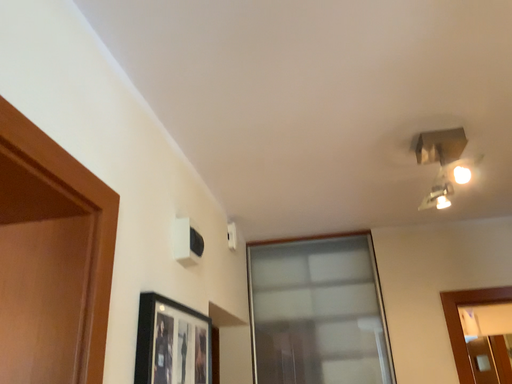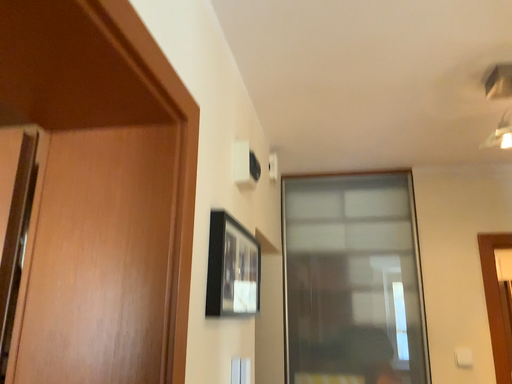
Question: How did the camera likely rotate when shooting the video?

Choices:
 (A) rotated upward
 (B) rotated downward

Answer: (B)